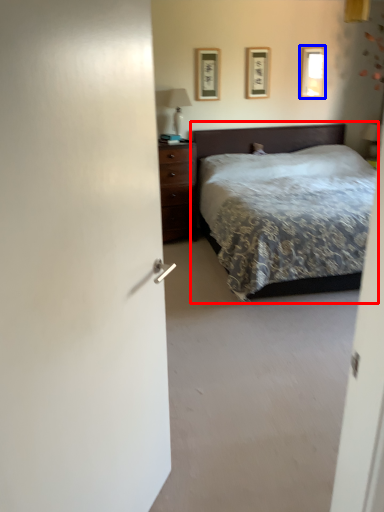
Question: Which object is further to the camera taking this photo, bed (highlighted by a red box) or picture frame (highlighted by a blue box)?

Choices:
 (A) bed
 (B) picture frame

Answer: (B)